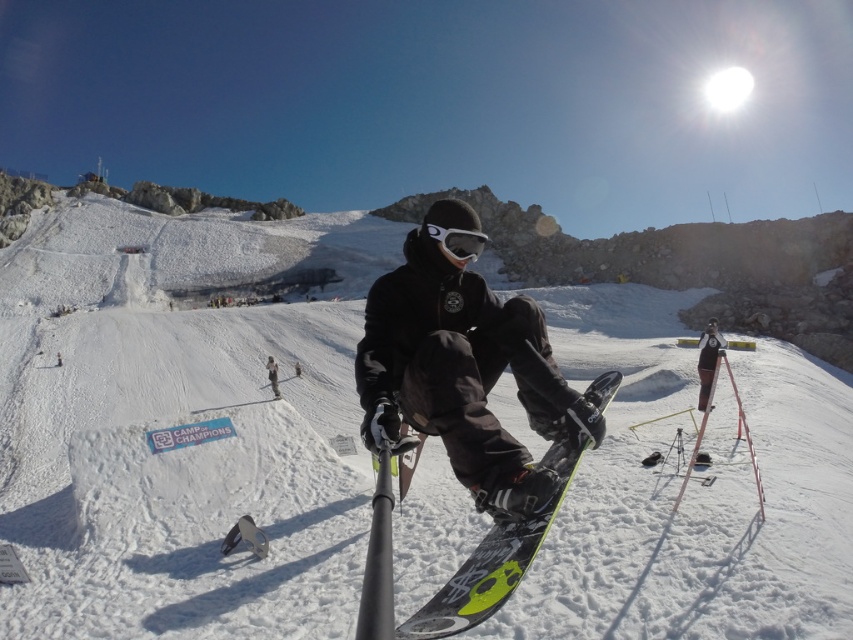
Question: Which of the following is the farthest from the observer?

Choices:
 (A) white matte goggles at center
 (B) neon yellow matte snowboard at center
 (C) black matte snowboarder at center
 (D) white matte snowboard at center

Answer: (A)

Question: Which object is the closest to the white matte goggles at center?

Choices:
 (A) white matte snowboard at center
 (B) neon yellow matte snowboard at center
 (C) black matte snowboarder at center

Answer: (C)

Question: Considering the relative positions of white matte snowboard at center and neon yellow matte snowboard at center in the image provided, where is white matte snowboard at center located with respect to neon yellow matte snowboard at center?

Choices:
 (A) below
 (B) above

Answer: (B)

Question: Which of the following is the farthest from the observer?

Choices:
 (A) neon yellow matte snowboard at center
 (B) white matte goggles at center

Answer: (B)

Question: Observing the image, what is the correct spatial positioning of neon yellow matte snowboard at center in reference to white matte goggles at center?

Choices:
 (A) right
 (B) left

Answer: (B)

Question: Can you confirm if white matte snowboard at center is positioned to the right of black matte snowboarder at center?

Choices:
 (A) yes
 (B) no

Answer: (B)